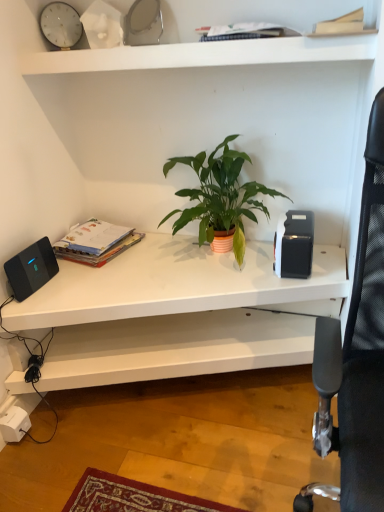
The width and height of the screenshot is (384, 512). I want to click on spots to the right of matte paperbacks at left, which is the 1th paperback book from left to right, so click(152, 252).